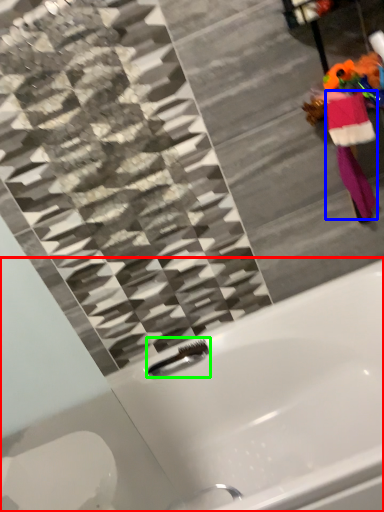
Question: Considering the real-world distances, which object is farthest from bathtub (highlighted by a red box)? robe (highlighted by a blue box) or faucet (highlighted by a green box)?

Choices:
 (A) robe
 (B) faucet

Answer: (A)